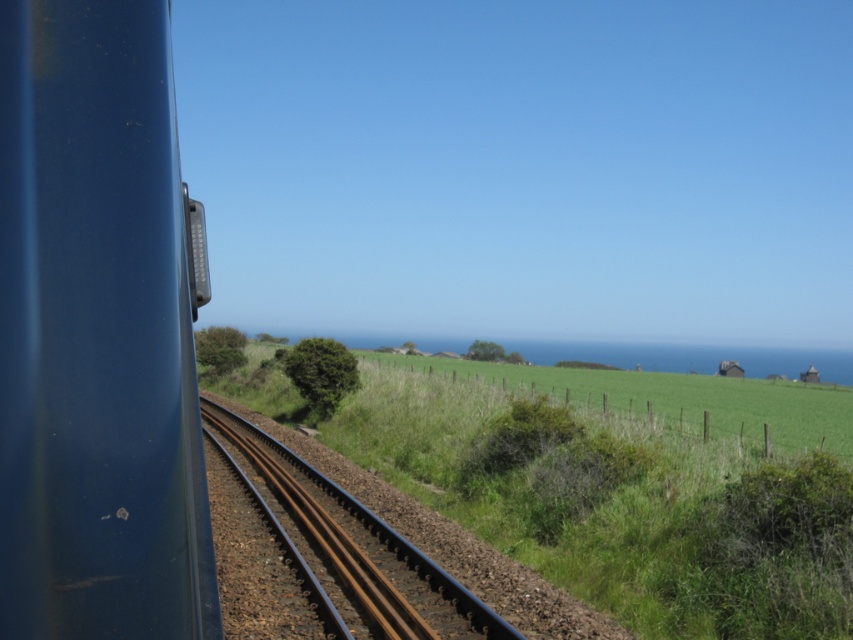
Between matte blue train at left and brown metal track at center, which one appears on the right side from the viewer's perspective?

From the viewer's perspective, matte blue train at left appears more on the right side.

Does matte blue train at left have a larger size compared to brown metal track at center?

Actually, matte blue train at left might be smaller than brown metal track at center.

Which is behind, point (13, 196) or point (364, 625)?

Point (364, 625)

Locate an element on the screen. The width and height of the screenshot is (853, 640). matte blue train at left is located at coordinates (96, 333).

How far apart are green grassy at center and brown metal track at center?

A distance of 11.11 meters exists between green grassy at center and brown metal track at center.

Is green grassy at center to the right of brown metal track at center from the viewer's perspective?

Correct, you'll find green grassy at center to the right of brown metal track at center.

Which is in front, point (547, 508) or point (364, 516)?

Positioned in front is point (547, 508).

The image size is (853, 640). In order to click on green grassy at center in this screenshot , I will do `click(616, 486)`.

Is matte blue train at left shorter than green grassy at center?

Yes, matte blue train at left is shorter than green grassy at center.

Between matte blue train at left and green grassy at center, which one is positioned higher?

matte blue train at left is above.

Identify the location of matte blue train at left. click(x=96, y=333).

Locate an element on the screen. The image size is (853, 640). matte blue train at left is located at coordinates (96, 333).